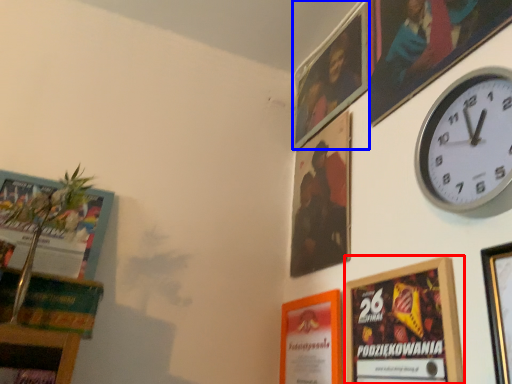
Question: Which object is further to the camera taking this photo, picture frame (highlighted by a red box) or picture frame (highlighted by a blue box)?

Choices:
 (A) picture frame
 (B) picture frame

Answer: (B)